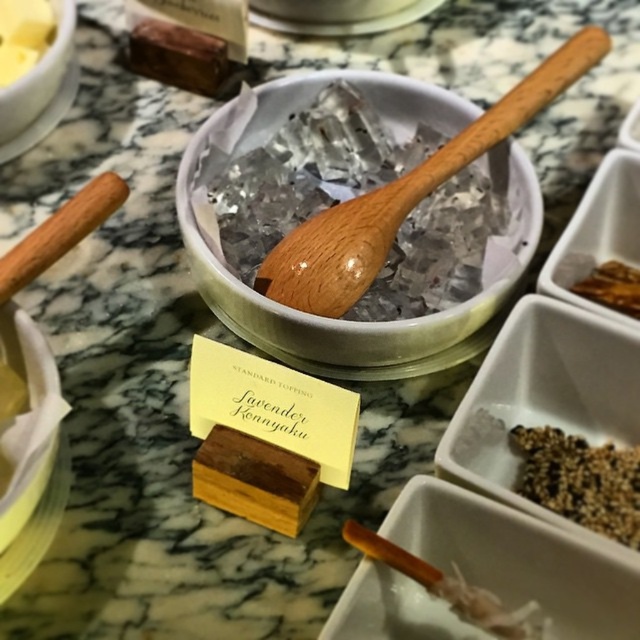
Question: Which of the following is the closest to the observer?

Choices:
 (A) yellow butter at upper left
 (B) wooden spoon at center
 (C) brown crispy snack at upper right

Answer: (B)

Question: Can you confirm if yellow butter at upper left is positioned to the left of brown crispy snack at upper right?

Choices:
 (A) no
 (B) yes

Answer: (B)

Question: Which object appears farthest from the camera in this image?

Choices:
 (A) wooden spoon at center
 (B) white ceramic bowl at upper left
 (C) yellow butter at upper left

Answer: (C)

Question: Which point is farther to the camera?

Choices:
 (A) yellow butter at upper left
 (B) brown textured grain at lower right
 (C) brown crispy snack at upper right
 (D) white ceramic bowl at upper left

Answer: (A)

Question: Does white ceramic bowl at upper left have a smaller size compared to brown crispy snack at upper right?

Choices:
 (A) no
 (B) yes

Answer: (A)

Question: Does brown textured grain at lower right have a greater width compared to yellow butter at upper left?

Choices:
 (A) yes
 (B) no

Answer: (A)